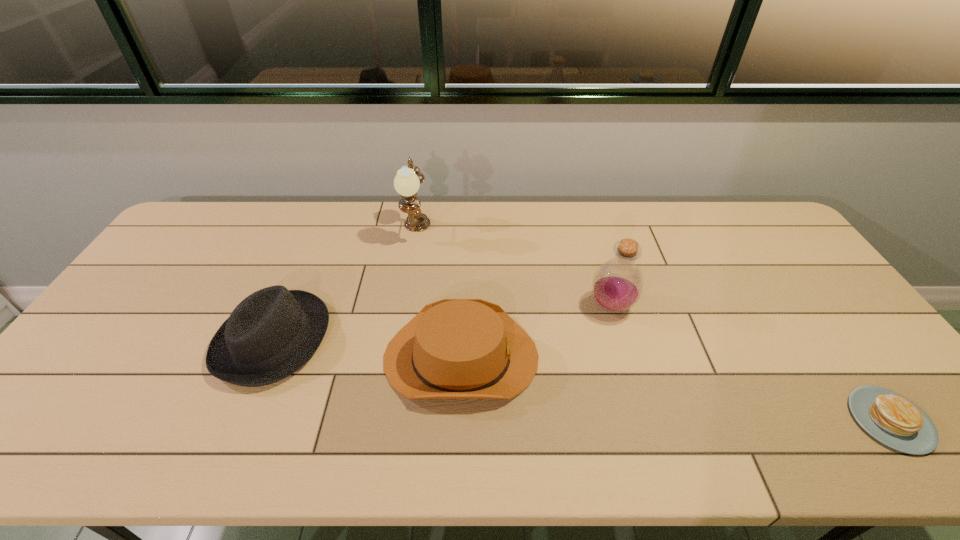
You are a GUI agent. You are given a task and a screenshot of the screen. Output one action in this format:
    pyautogui.click(x=<x>, y=<y>)
    Task: Click on the vacant space located 0.080m on the front of the fedora
    This screenshot has width=960, height=540.
    Given the screenshot: What is the action you would take?
    pyautogui.click(x=237, y=423)

At what (x,y) coordinates should I click in order to perform the action: click on blank area located 0.340m on the front-facing side of the second shortest object. Please return your answer as a coordinate pair (x, y). This screenshot has width=960, height=540. Looking at the image, I should click on (669, 357).

Where is `free space located on the left of the rightmost object`? The height and width of the screenshot is (540, 960). free space located on the left of the rightmost object is located at coordinates (827, 420).

Image resolution: width=960 pixels, height=540 pixels. In order to click on object at the far edge in this screenshot , I will do `click(407, 181)`.

At what (x,y) coordinates should I click in order to perform the action: click on object that is at the near edge. Please return your answer as a coordinate pair (x, y). Looking at the image, I should click on (891, 418).

Image resolution: width=960 pixels, height=540 pixels. In order to click on object that is at the right edge in this screenshot , I will do `click(891, 418)`.

The height and width of the screenshot is (540, 960). What are the coordinates of `object located in the near right corner section of the desktop` in the screenshot? It's located at (891, 418).

You are a GUI agent. You are given a task and a screenshot of the screen. Output one action in this format:
    pyautogui.click(x=<x>, y=<y>)
    Task: Click on the blank space at the far edge of the desktop
    The width and height of the screenshot is (960, 540).
    Given the screenshot: What is the action you would take?
    pyautogui.click(x=628, y=230)

At what (x,y) coordinates should I click in order to perform the action: click on vacant space at the near edge of the desktop. Please return your answer as a coordinate pair (x, y). The height and width of the screenshot is (540, 960). Looking at the image, I should click on (461, 455).

Image resolution: width=960 pixels, height=540 pixels. Find the location of `blank space at the left edge of the desktop`. blank space at the left edge of the desktop is located at coordinates (181, 281).